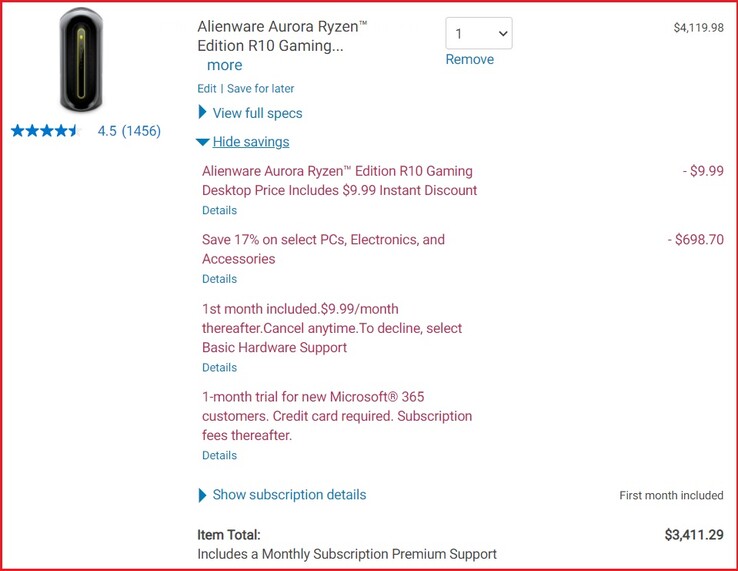
I want to click on computer tower, so click(x=86, y=24).